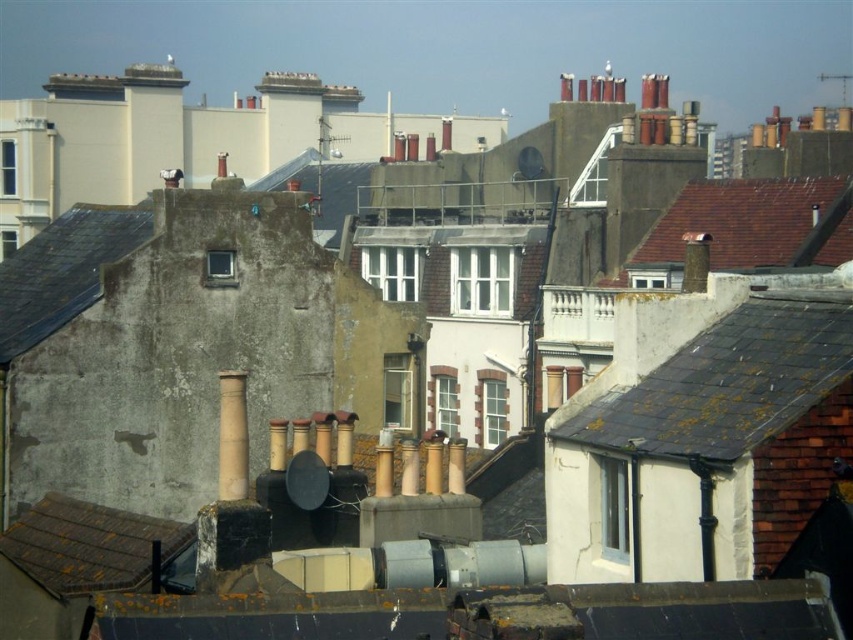
Question: Is dark gray slate roof at upper right bigger than gray slate roof at center?

Choices:
 (A) no
 (B) yes

Answer: (A)

Question: Among these points, which one is farthest from the camera?

Choices:
 (A) (222, 442)
 (B) (115, 563)

Answer: (B)

Question: Which is nearer to the brown tiled roof at upper right?

Choices:
 (A) brown clay chimney at center
 (B) brown tile roof at lower left
 (C) gray slate roof at center

Answer: (A)

Question: Is brown tiled roof at upper right wider than brown clay chimney at center?

Choices:
 (A) no
 (B) yes

Answer: (B)

Question: Estimate the real-world distances between objects in this image. Which object is closer to the dark gray slate roof at upper right?

Choices:
 (A) brown tile roof at lower left
 (B) gray slate roof at center
 (C) brown tiled roof at upper right
 (D) brown clay chimney at center

Answer: (D)

Question: Can you confirm if brown tiled roof at upper right is thinner than brown tile roof at lower left?

Choices:
 (A) yes
 (B) no

Answer: (B)